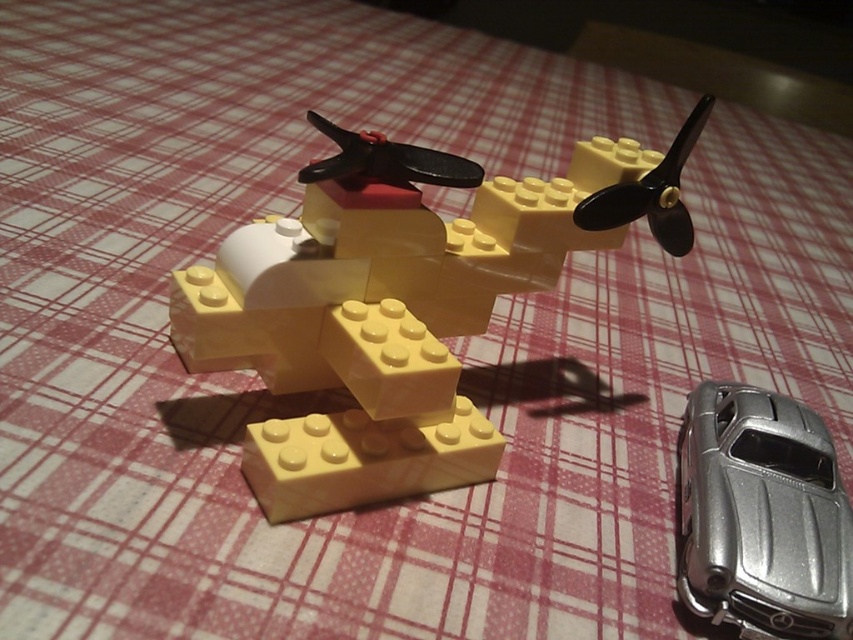
The width and height of the screenshot is (853, 640). I want to click on yellow matte airplane at center, so click(x=399, y=305).

Can you confirm if yellow matte airplane at center is bigger than silver metallic car at lower right?

Indeed, yellow matte airplane at center has a larger size compared to silver metallic car at lower right.

Which is behind, point (329, 342) or point (775, 419)?

The point (775, 419) is behind.

The height and width of the screenshot is (640, 853). I want to click on yellow matte airplane at center, so click(399, 305).